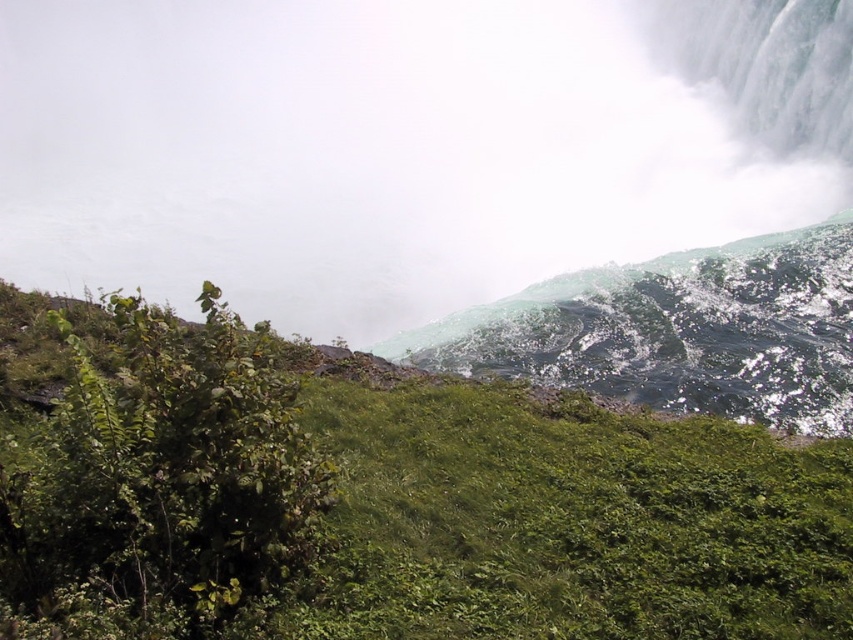
Looking at this image, you are standing at the base of the waterfall and want to climb up to the green grassy hillside at center. Based on its location, can you estimate how far you need to walk horizontally from your current position to reach it?

The green grassy hillside at center is located at point 0.786 on the x coordinate and 0.461 on the y coordinate. Since you are at the base of the waterfall, you would need to walk approximately 0.786 units horizontally to reach it.

You are standing in front of the waterfall and see the green grassy hillside at center and the white misty fog at upper center. Which object is located to the right of the other?

The green grassy hillside at center is positioned on the right side of white misty fog at upper center, so the green grassy hillside at center is to the right of the white misty fog at upper center.